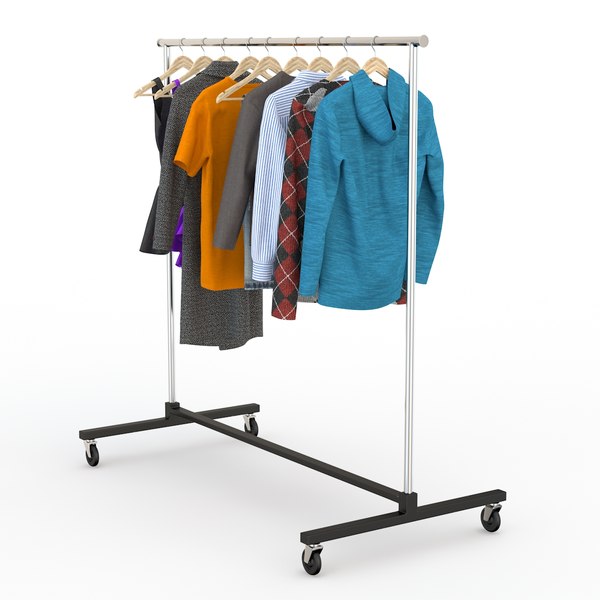
Find the location of a particular element. wooden hanger is located at coordinates (374, 64), (348, 64), (314, 63), (296, 63), (266, 62), (248, 62), (223, 55), (208, 63), (181, 63).